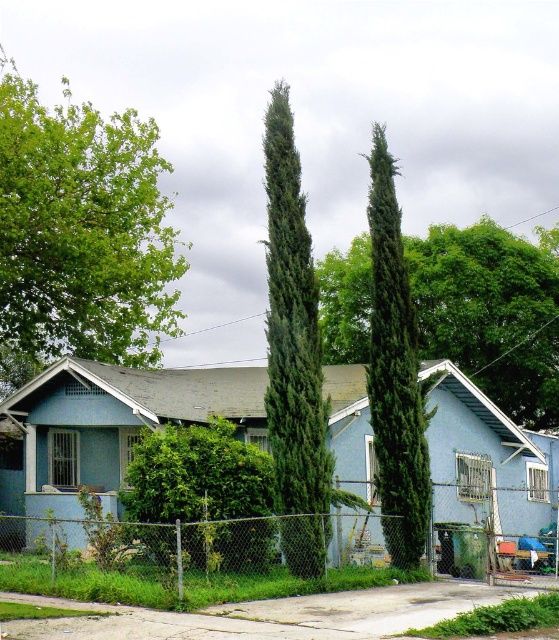
You are a gardener planning to trim the green leafy tree at upper left and the green leafy bush at center. Based on their positions, which one do you need to reach first to avoid obstructing your view of the other?

The green leafy tree at upper left is positioned over the green leafy bush at center, so you should trim the green leafy tree at upper left first to avoid its branches blocking your view of the bush below.

You are a landscape architect planning to install a new walkway between the green textured tree at center and the green textured cypress tree at center. The walkway requires a minimum of 8 meters of space. Based on the scene, will there be enough space for the walkway?

The green textured tree at center and green textured cypress tree at center are 10.21 meters apart from each other, which is more than the required 8 meters. Therefore, there is sufficient space to install the walkway between them.

Based on the photo, you are a landscape architect planning to install a new garden path between the green leafy tree at upper left and the green leafy bush at center. Considering their heights, which object might require pruning to ensure the path remains accessible for pedestrians?

The green leafy tree at upper left has a greater height compared to the green leafy bush at center, so it might require pruning to ensure the path remains accessible for pedestrians.